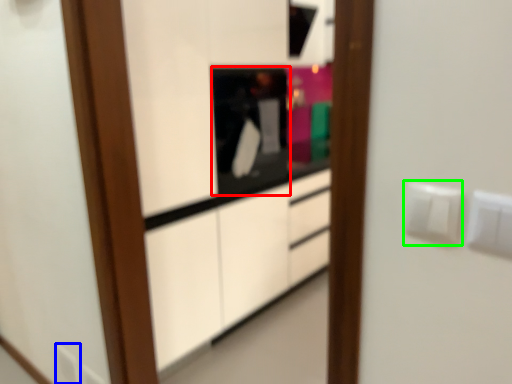
Question: Which object is positioned closest to appliance (highlighted by a red box)? Select from electric outlet (highlighted by a blue box) and electric outlet (highlighted by a green box).

Choices:
 (A) electric outlet
 (B) electric outlet

Answer: (A)